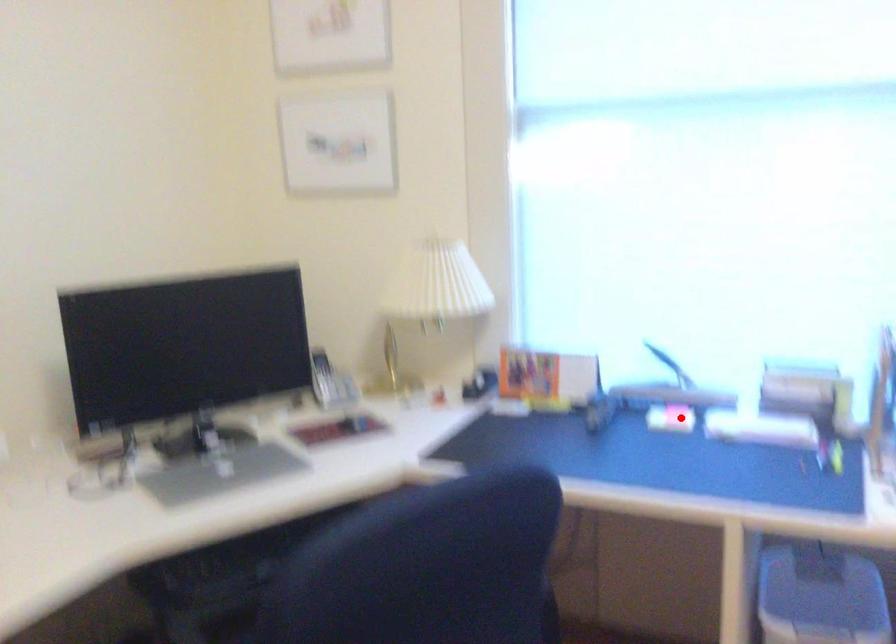
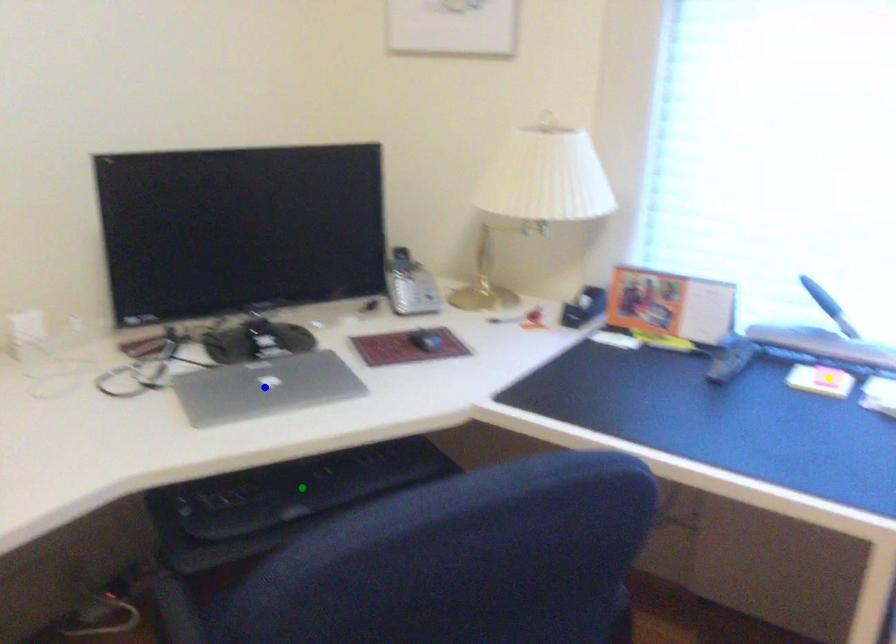
Question: I am providing you with two images of the same scene from different viewpoints. A red point is marked on the first image. You are given multiple points on the second image. Which mark in image 2 goes with the point in image 1?

Choices:
 (A) green point
 (B) yellow point
 (C) blue point

Answer: (B)